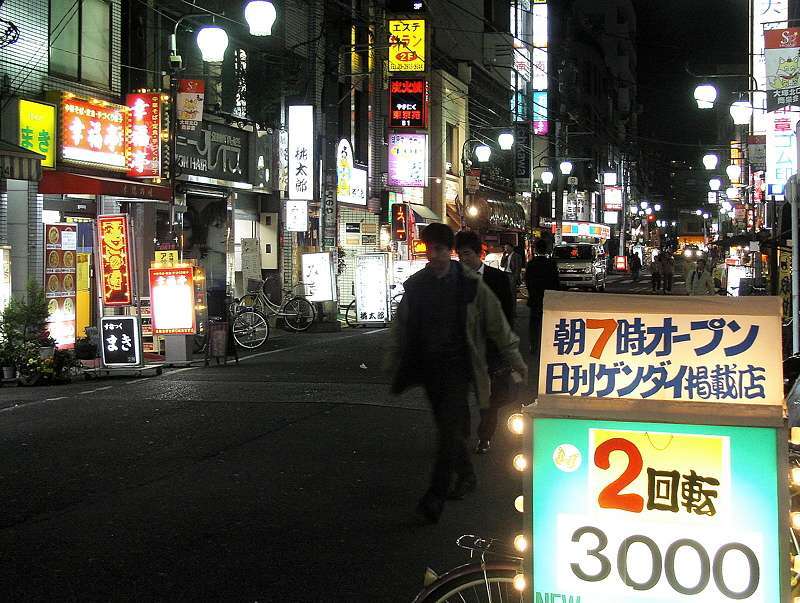
Image resolution: width=800 pixels, height=603 pixels. I want to click on plant, so click(30, 338).